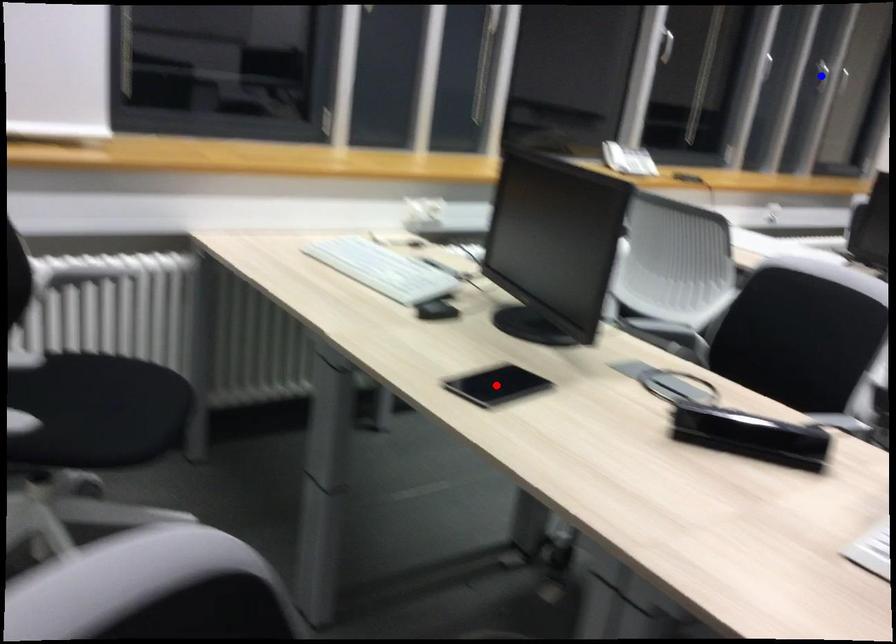
Question: In the image, two points are highlighted. Which point is nearer to the camera? Reply with the corresponding letter.

Choices:
 (A) blue point
 (B) red point

Answer: (B)